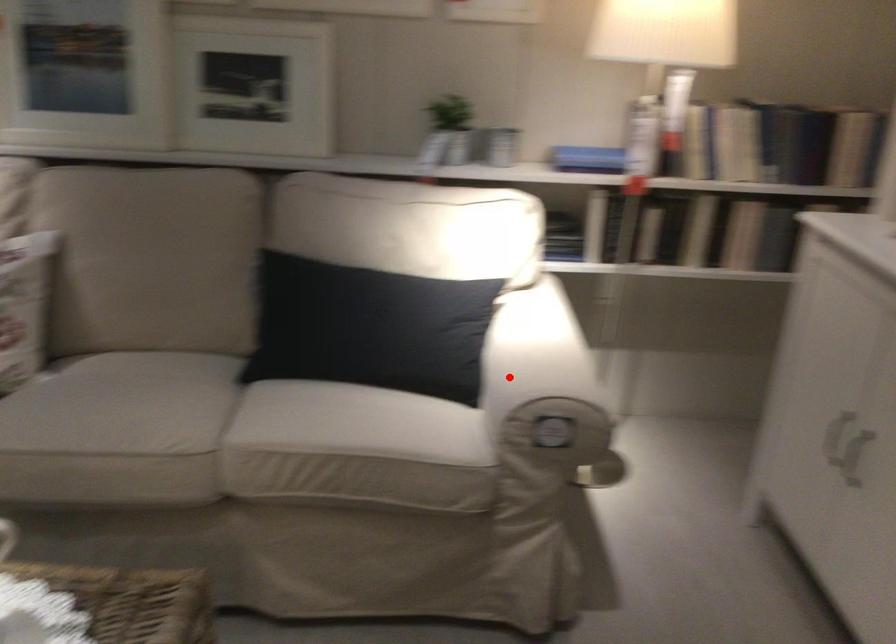
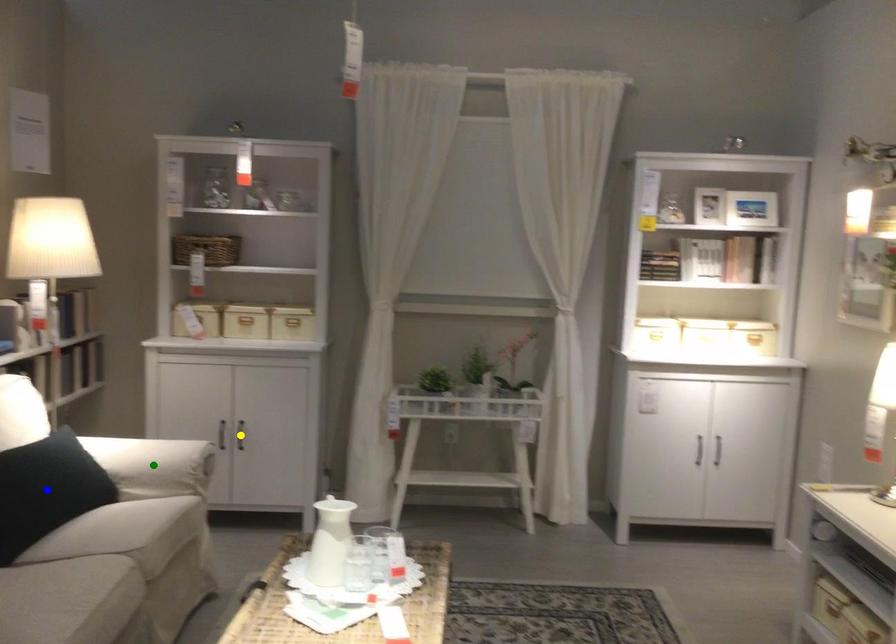
Question: I am providing you with two images of the same scene from different viewpoints. A red point is marked on the first image. You are given multiple points on the second image. Which spot in image 2 lines up with the point in image 1?

Choices:
 (A) green point
 (B) yellow point
 (C) blue point

Answer: (A)